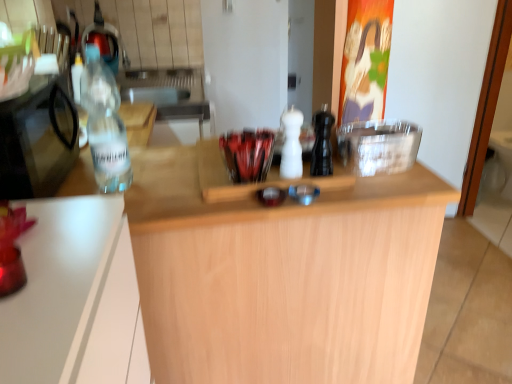
The width and height of the screenshot is (512, 384). Find the location of `free spot to the right of black matte pepper grinder at center, arranged as the first bottle when viewed from the right`. free spot to the right of black matte pepper grinder at center, arranged as the first bottle when viewed from the right is located at coordinates (367, 170).